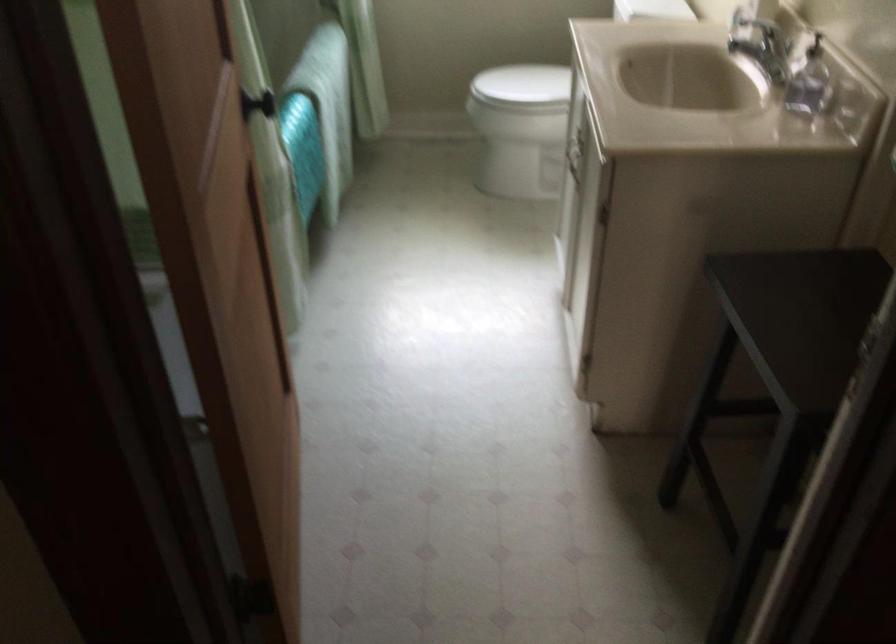
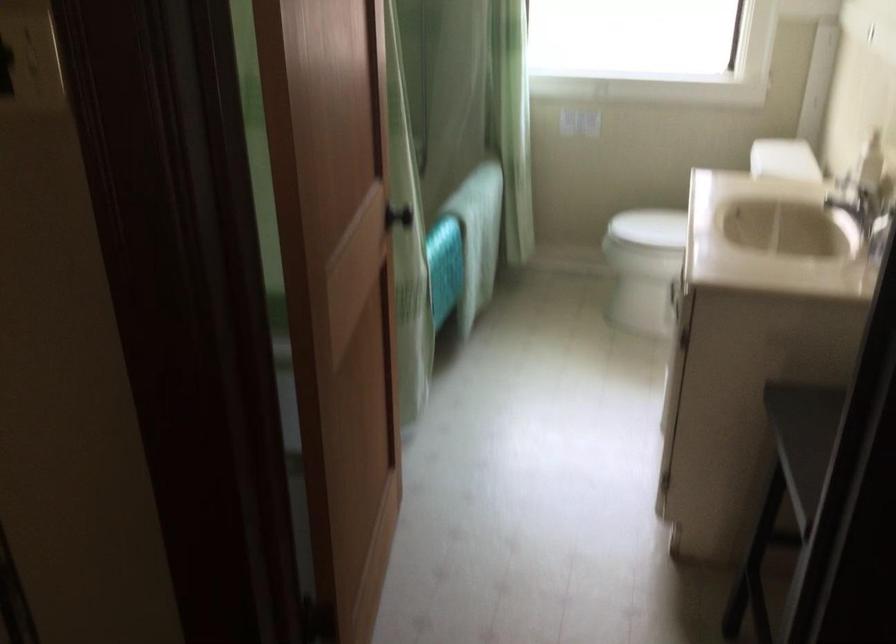
The images are taken continuously from a first-person perspective. In which direction are you moving?

The movement direction of the cameraman is right, backward.